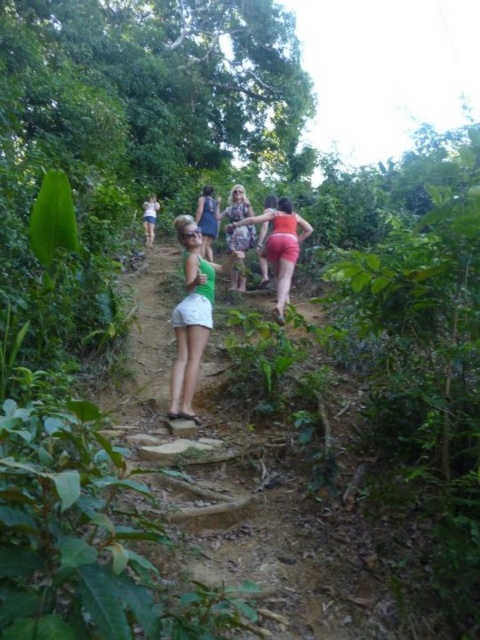
Which is more to the left, green matte shorts at center or white matte shorts at center?

From the viewer's perspective, white matte shorts at center appears more on the left side.

Is green matte shorts at center positioned behind white matte shorts at center?

No.

This screenshot has width=480, height=640. What do you see at coordinates (192, 316) in the screenshot? I see `green matte shorts at center` at bounding box center [192, 316].

The height and width of the screenshot is (640, 480). What are the coordinates of `green matte shorts at center` in the screenshot? It's located at (192, 316).

Image resolution: width=480 pixels, height=640 pixels. What do you see at coordinates (280, 244) in the screenshot?
I see `matte coral shorts at center` at bounding box center [280, 244].

Is matte coral shorts at center shorter than white matte shorts at center?

No.

Between point (288, 227) and point (152, 204), which one is positioned behind?

Point (152, 204)

This screenshot has width=480, height=640. What are the coordinates of `matte coral shorts at center` in the screenshot? It's located at (280, 244).

Consider the image. Can you confirm if matte coral shorts at center is wider than patterned fabric dress at center?

Yes, matte coral shorts at center is wider than patterned fabric dress at center.

Between point (311, 232) and point (241, 266), which one is positioned behind?

Positioned behind is point (241, 266).

The height and width of the screenshot is (640, 480). What are the coordinates of `matte coral shorts at center` in the screenshot? It's located at (280, 244).